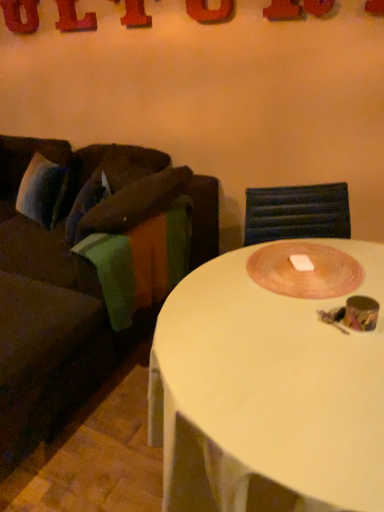
Image resolution: width=384 pixels, height=512 pixels. In order to click on free spot above white plastic coffee table at center (from a real-world perspective) in this screenshot , I will do `click(292, 323)`.